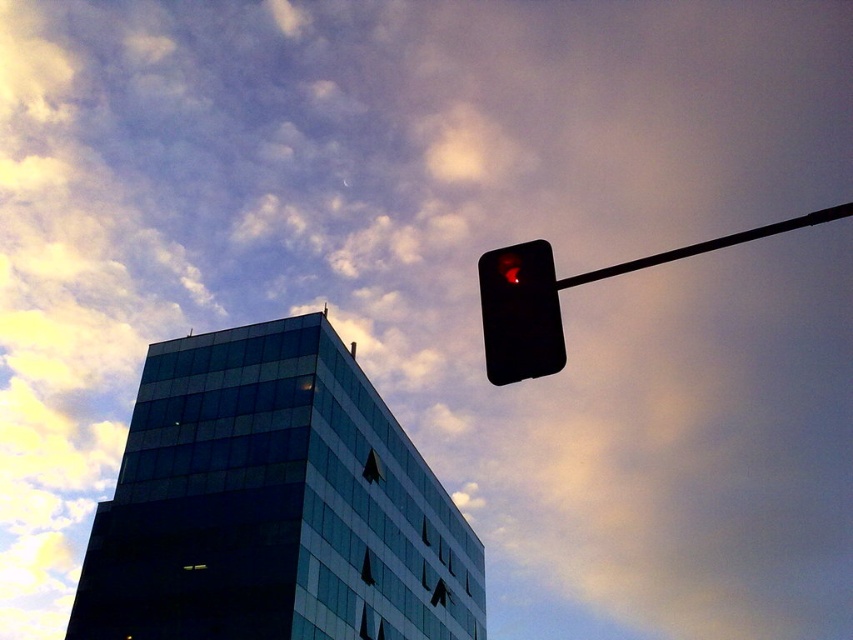
Who is shorter, black matte traffic light at upper right or black plastic pole at upper right?

black matte traffic light at upper right

Does black matte traffic light at upper right come behind black plastic pole at upper right?

That is False.

Where is `black matte traffic light at upper right`? The width and height of the screenshot is (853, 640). black matte traffic light at upper right is located at coordinates (520, 312).

At what (x,y) coordinates should I click in order to perform the action: click on black matte traffic light at upper right. Please return your answer as a coordinate pair (x, y). Looking at the image, I should click on (520, 312).